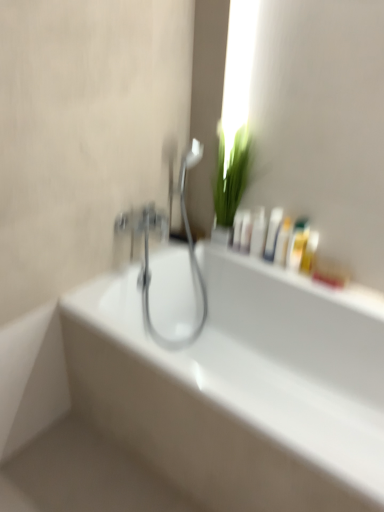
Question: Does white glossy bathtub at center appear on the left side of white glossy bottle at upper right, which is counted as the seventh mouthwash, starting from the right?

Choices:
 (A) yes
 (B) no

Answer: (A)

Question: Is white glossy bathtub at center oriented towards white glossy bottle at upper right, which is counted as the seventh mouthwash, starting from the right?

Choices:
 (A) no
 (B) yes

Answer: (A)

Question: Is white glossy bathtub at center positioned beyond the bounds of white glossy bottle at upper right, arranged as the 1th mouthwash when viewed from the left?

Choices:
 (A) yes
 (B) no

Answer: (A)

Question: Can you confirm if white glossy bathtub at center is shorter than white glossy bottle at upper right, which is counted as the seventh mouthwash, starting from the right?

Choices:
 (A) no
 (B) yes

Answer: (A)

Question: Does white glossy bathtub at center come in front of white glossy bottle at upper right, which is counted as the seventh mouthwash, starting from the right?

Choices:
 (A) no
 (B) yes

Answer: (B)

Question: Based on their positions, is white glossy bottle at upper center, which appears as the sixth mouthwash when viewed from the right, located to the left or right of white glossy bathtub at center?

Choices:
 (A) left
 (B) right

Answer: (B)

Question: Considering the positions of white glossy bottle at upper center, the 2th mouthwash positioned from the left, and white glossy bathtub at center in the image, is white glossy bottle at upper center, the 2th mouthwash positioned from the left, taller or shorter than white glossy bathtub at center?

Choices:
 (A) tall
 (B) short

Answer: (B)

Question: Considering the positions of point (243, 231) and point (196, 316), is point (243, 231) closer or farther from the camera than point (196, 316)?

Choices:
 (A) closer
 (B) farther

Answer: (A)

Question: Is white glossy bottle at upper center, the 2th mouthwash positioned from the left, inside or outside of white glossy bathtub at center?

Choices:
 (A) outside
 (B) inside

Answer: (A)

Question: From a real-world perspective, is translucent plastic bottle at upper right, positioned as the sixth mouthwash in left-to-right order, positioned above or below polished chrome faucet at center?

Choices:
 (A) below
 (B) above

Answer: (B)

Question: From the image's perspective, is translucent plastic bottle at upper right, the 2th mouthwash in the right-to-left sequence, located above or below polished chrome faucet at center?

Choices:
 (A) above
 (B) below

Answer: (A)

Question: Is translucent plastic bottle at upper right, positioned as the sixth mouthwash in left-to-right order, bigger or smaller than polished chrome faucet at center?

Choices:
 (A) big
 (B) small

Answer: (B)

Question: Do you think translucent plastic bottle at upper right, positioned as the sixth mouthwash in left-to-right order, is within polished chrome faucet at center, or outside of it?

Choices:
 (A) outside
 (B) inside

Answer: (A)

Question: Looking at the image, does white glossy bottle at upper right, which is counted as the seventh mouthwash, starting from the right, seem bigger or smaller compared to green leafy plant at upper center?

Choices:
 (A) small
 (B) big

Answer: (A)

Question: Would you say white glossy bottle at upper right, arranged as the 1th mouthwash when viewed from the left, is inside or outside green leafy plant at upper center?

Choices:
 (A) inside
 (B) outside

Answer: (A)